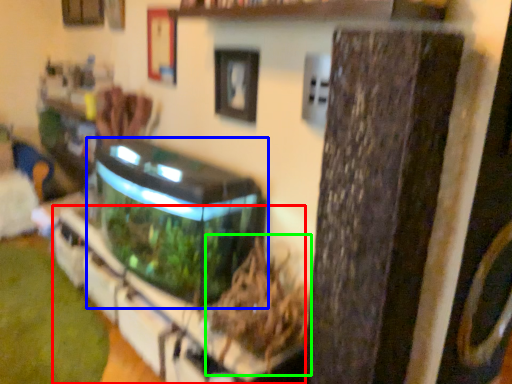
Question: Estimate the real-world distances between objects in this image. Which object is closer to shelf (highlighted by a red box), water tank (highlighted by a blue box) or plant (highlighted by a green box)?

Choices:
 (A) water tank
 (B) plant

Answer: (B)